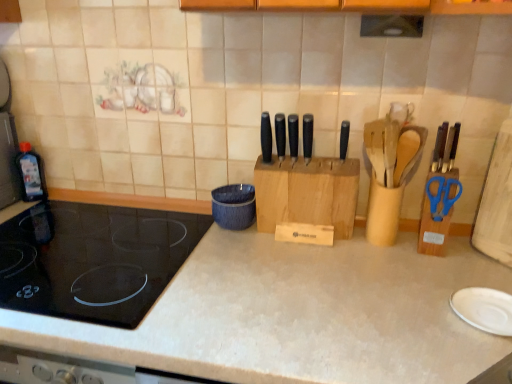
The width and height of the screenshot is (512, 384). I want to click on free space to the left of wooden knife block at center, so click(x=222, y=243).